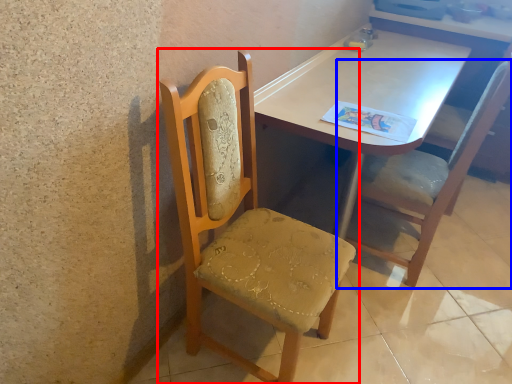
Question: Which point is closer to the camera, chair (highlighted by a red box) or chair (highlighted by a blue box)?

Choices:
 (A) chair
 (B) chair

Answer: (A)